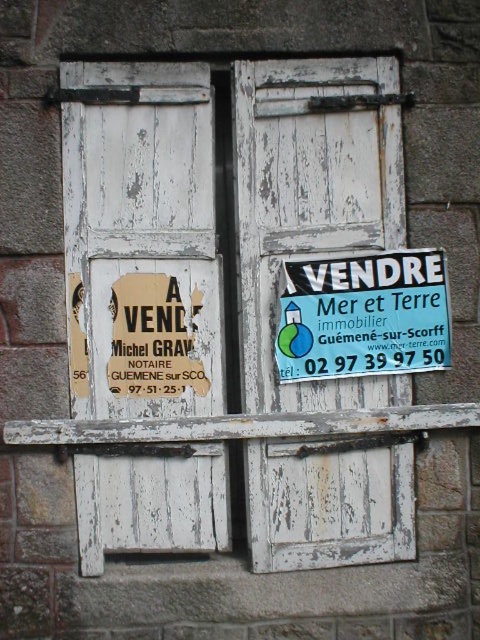
Which is more to the left, white wooden door at center or blue plastic sign at center?

From the viewer's perspective, white wooden door at center appears more on the left side.

Which is behind, point (370, 483) or point (290, 310)?

Positioned behind is point (370, 483).

Where is `white wooden door at center`? white wooden door at center is located at coordinates (278, 310).

Between white wooden door at left and white wooden door at center, which one is positioned higher?

white wooden door at center

Is white wooden door at left smaller than white wooden door at center?

No.

Describe the element at coordinates (141, 241) in the screenshot. This screenshot has width=480, height=640. I see `white wooden door at left` at that location.

Where is `white wooden door at left`? This screenshot has height=640, width=480. white wooden door at left is located at coordinates pos(141,241).

Identify the location of white wooden door at left. (141, 241).

I want to click on white wooden door at left, so click(x=141, y=241).

Image resolution: width=480 pixels, height=640 pixels. Find the location of `white wooden door at left`. white wooden door at left is located at coordinates (141, 241).